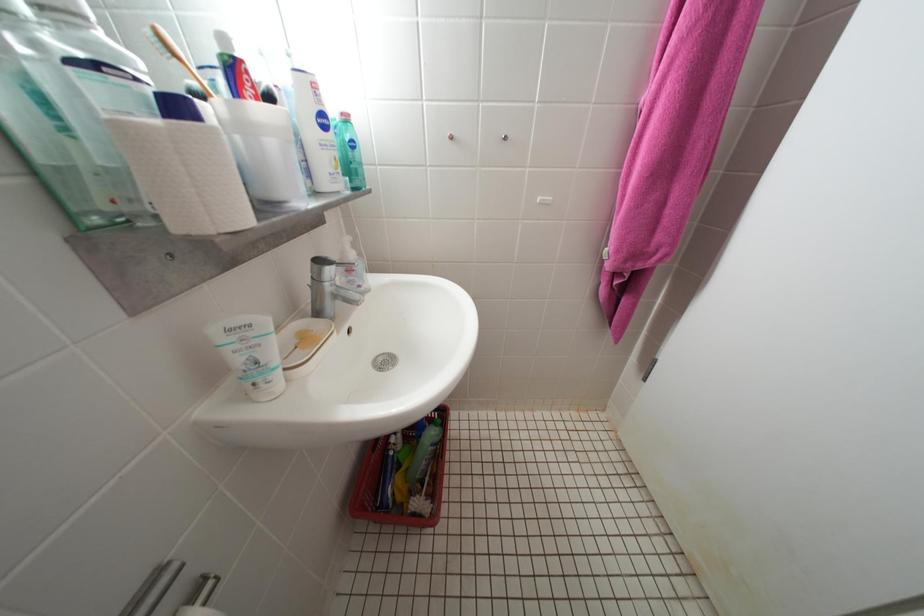
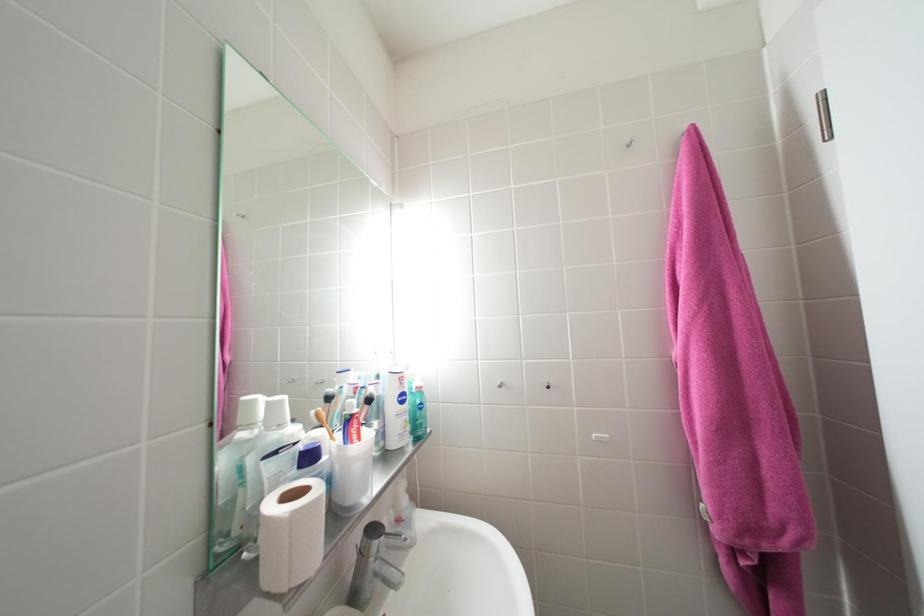
The images are taken continuously from a first-person perspective. In which direction is your viewpoint rotating?

The camera rotated toward left-up.